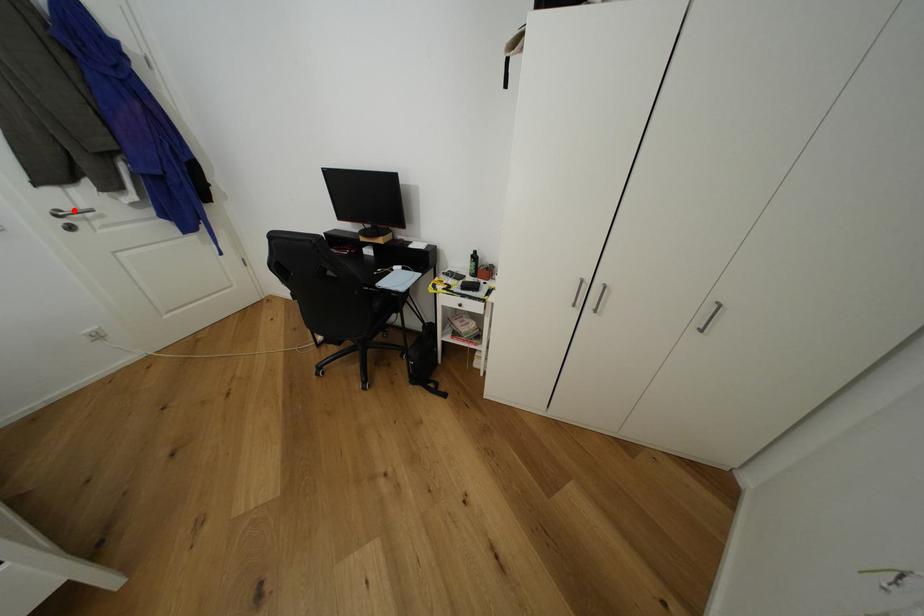
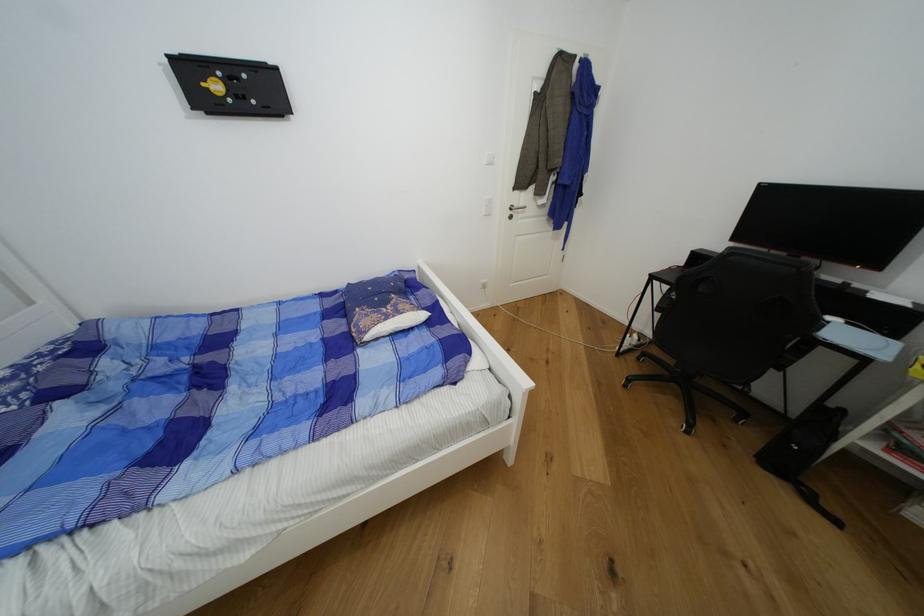
Where in the second image is the point corresponding to the highlighted location from the first image?

(521, 207)